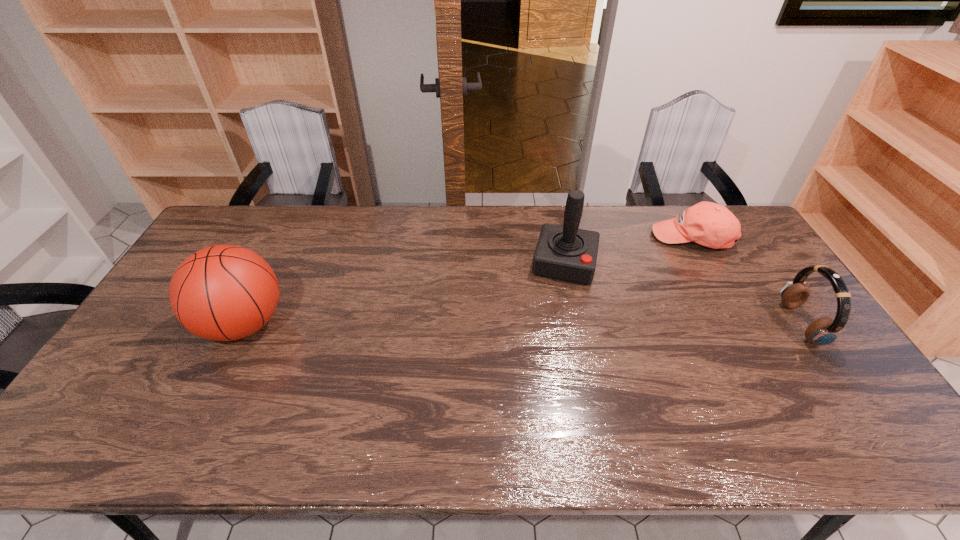
This screenshot has height=540, width=960. In order to click on free spot on the desktop that is between the leftmost object and the headset and is positioned on the base of the second object from left to right in this screenshot , I will do `click(552, 324)`.

I want to click on vacant space on the desktop that is between the basketball and the second shortest object and is positioned on the front-facing side of the baseball cap, so click(593, 324).